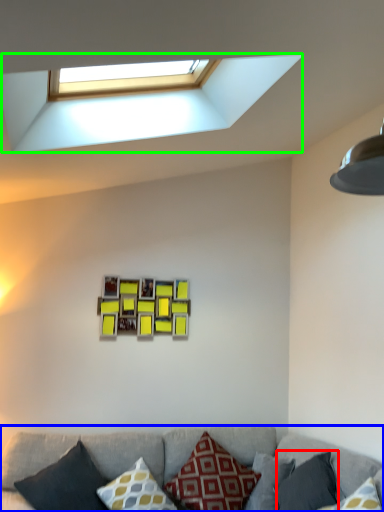
Question: Which is nearer to the pillow (highlighted by a red box)? studio couch (highlighted by a blue box) or window (highlighted by a green box).

Choices:
 (A) studio couch
 (B) window

Answer: (A)